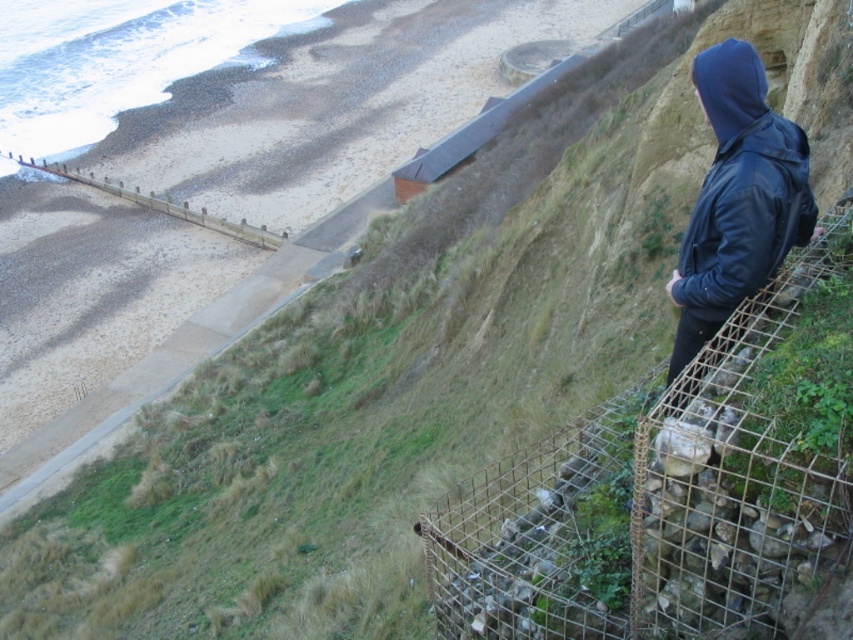
Question: Does metal wire mesh at right appear over black leather jacket at right?

Choices:
 (A) no
 (B) yes

Answer: (A)

Question: Is metal wire mesh at right smaller than black leather jacket at right?

Choices:
 (A) no
 (B) yes

Answer: (A)

Question: Which point is farther from the camera taking this photo?

Choices:
 (A) (675, 413)
 (B) (793, 180)

Answer: (B)

Question: Which object appears farthest from the camera in this image?

Choices:
 (A) metal wire mesh at right
 (B) black leather jacket at right

Answer: (B)

Question: Is metal wire mesh at right to the left of black leather jacket at right from the viewer's perspective?

Choices:
 (A) no
 (B) yes

Answer: (B)